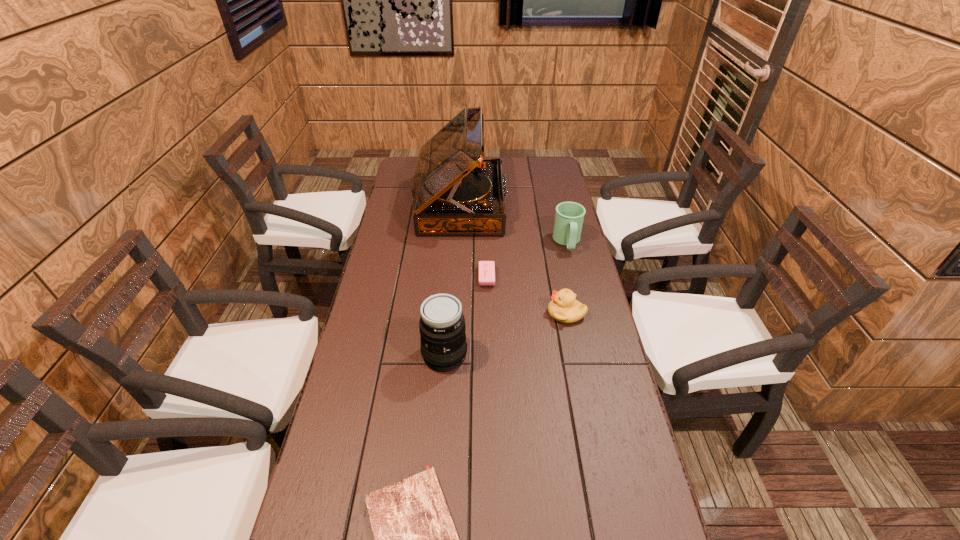
You are a GUI agent. You are given a task and a screenshot of the screen. Output one action in this format:
    pyautogui.click(x=<x>, y=<y>)
    Task: Click on the free space located 0.370m on the side of the mug with the handle
    The image size is (960, 540).
    Given the screenshot: What is the action you would take?
    pyautogui.click(x=589, y=336)

Where is `free space located on the front-facing side of the third nearest object`? This screenshot has height=540, width=960. free space located on the front-facing side of the third nearest object is located at coordinates (489, 313).

Where is `free region located 0.250m on the front-facing side of the third nearest object`? Image resolution: width=960 pixels, height=540 pixels. free region located 0.250m on the front-facing side of the third nearest object is located at coordinates (467, 313).

Where is `vacant space positioned 0.360m on the front-facing side of the third nearest object`? The image size is (960, 540). vacant space positioned 0.360m on the front-facing side of the third nearest object is located at coordinates (430, 313).

Find the location of `vacant space located on the right of the fifth tallest object`. vacant space located on the right of the fifth tallest object is located at coordinates coord(542,278).

This screenshot has width=960, height=540. I want to click on object that is positioned at the far edge, so click(455, 191).

At what (x,y) coordinates should I click in order to perform the action: click on object that is at the left edge. Please return your answer as a coordinate pair (x, y). The width and height of the screenshot is (960, 540). Looking at the image, I should click on (455, 191).

I want to click on mug that is at the right edge, so click(569, 217).

This screenshot has height=540, width=960. What are the coordinates of `duckling that is at the right edge` in the screenshot? It's located at (564, 307).

Where is `object that is at the far left corner`? The height and width of the screenshot is (540, 960). object that is at the far left corner is located at coordinates (455, 191).